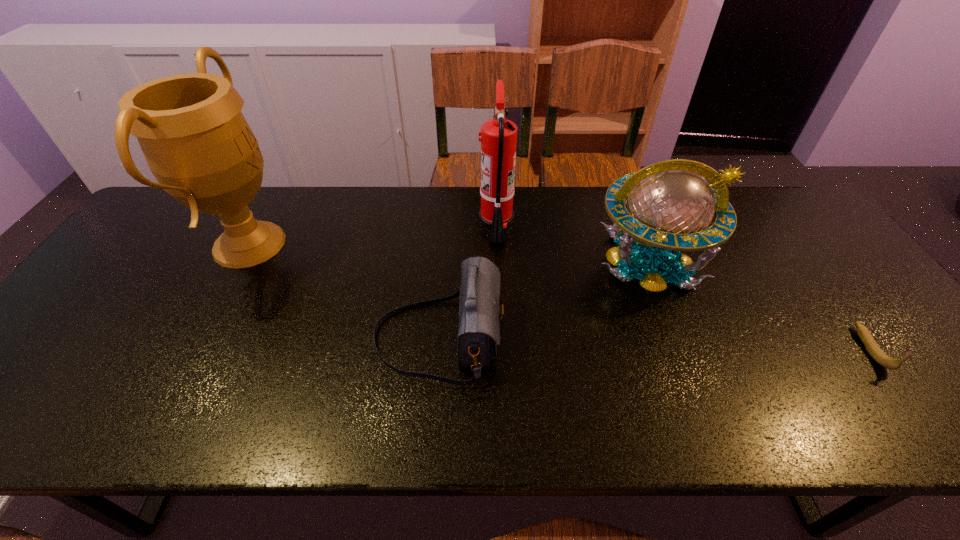
The width and height of the screenshot is (960, 540). In order to click on free space at the near edge in this screenshot , I will do `click(175, 402)`.

This screenshot has width=960, height=540. I want to click on vacant space at the left edge of the desktop, so click(x=118, y=332).

Where is `vacant position at the far right corner of the desktop`? This screenshot has height=540, width=960. vacant position at the far right corner of the desktop is located at coordinates (802, 227).

In the image, there is a desktop. Identify the location of vacant space at the near right corner. pyautogui.click(x=918, y=424).

Image resolution: width=960 pixels, height=540 pixels. What are the coordinates of `unoccupied area between the second object from right to left and the fourth shortest object` in the screenshot? It's located at (573, 242).

Locate an element on the screen. This screenshot has width=960, height=540. empty space between the banana and the second shortest object is located at coordinates (655, 343).

This screenshot has width=960, height=540. I want to click on vacant space that's between the tallest object and the fourth shortest object, so click(372, 234).

At what (x,y) coordinates should I click in order to perform the action: click on free space between the second tallest object and the globe. Please return your answer as a coordinate pair (x, y). Looking at the image, I should click on (573, 242).

Image resolution: width=960 pixels, height=540 pixels. What are the coordinates of `vacant region between the fire extinguisher and the leftmost object` in the screenshot? It's located at (372, 234).

Where is `unoccupied position between the third tallest object and the fourth shortest object`? unoccupied position between the third tallest object and the fourth shortest object is located at coordinates (573, 242).